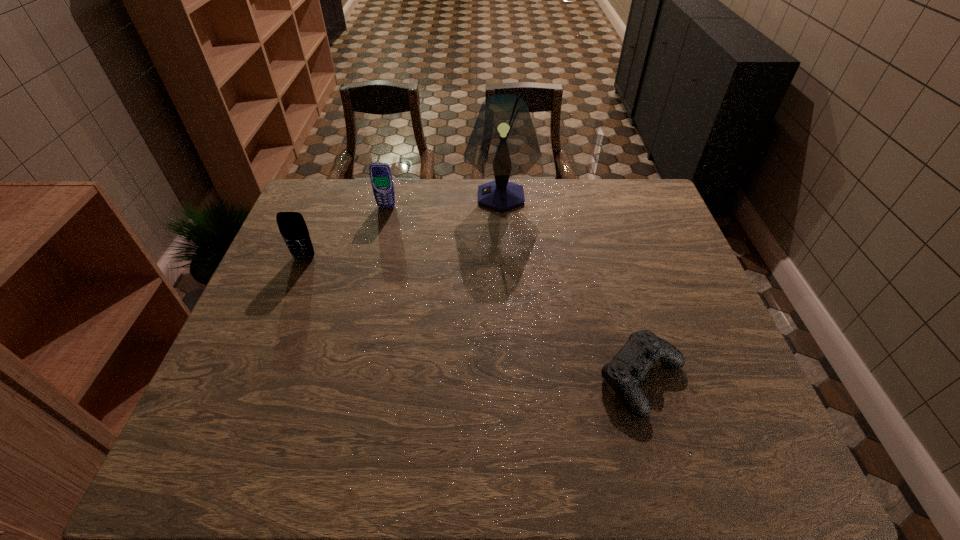
What are the coordinates of `vacant area that satisfies the following two spatial constraints: 1. on the front-facing side of the rightmost object; 2. on the left side of the third object from right to left` in the screenshot? It's located at (345, 379).

At what (x,y) coordinates should I click in order to perform the action: click on free space that satisfies the following two spatial constraints: 1. on the front-facing side of the shortest object; 2. on the left side of the third object from right to left. Please return your answer as a coordinate pair (x, y). Looking at the image, I should click on (345, 379).

Locate an element on the screen. This screenshot has height=540, width=960. free spot that satisfies the following two spatial constraints: 1. on the base of the second object from right to left; 2. on the front-facing side of the second object from left to right is located at coordinates (501, 206).

I want to click on free spot that satisfies the following two spatial constraints: 1. on the base of the third object from left to right; 2. on the screen of the leftmost object, so click(x=504, y=258).

Locate an element on the screen. This screenshot has height=540, width=960. blank area in the image that satisfies the following two spatial constraints: 1. on the base of the lampshade; 2. on the front-facing side of the third object from right to left is located at coordinates (501, 206).